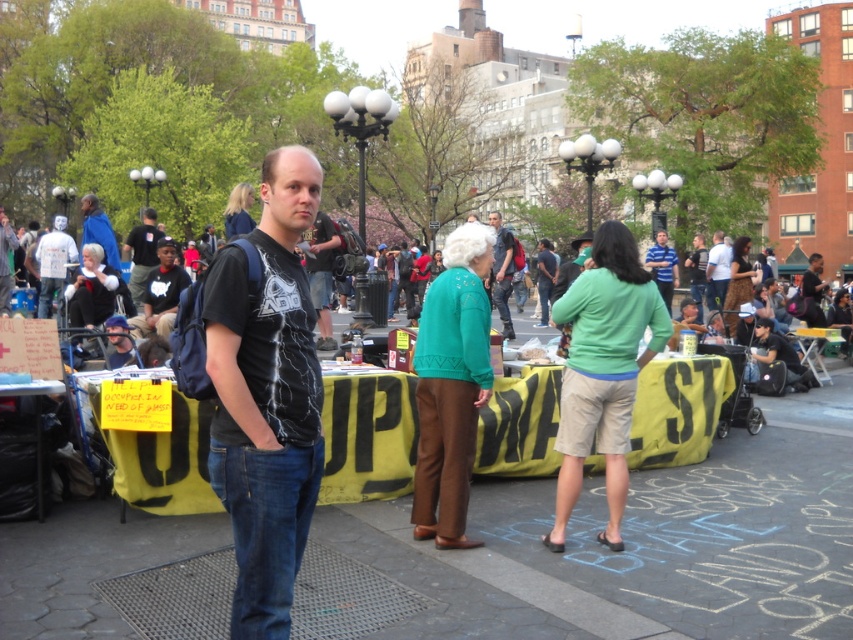
Question: Which of these objects is positioned closest to the matte black backpack at center?

Choices:
 (A) black matte t-shirt at center
 (B) dark blue backpack at center
 (C) white cotton shirt at upper right

Answer: (C)

Question: Does black matte t-shirt at center appear over dark blue backpack at center?

Choices:
 (A) yes
 (B) no

Answer: (B)

Question: Is dark blue backpack at center in front of matte black backpack at center?

Choices:
 (A) no
 (B) yes

Answer: (B)

Question: Which point appears closest to the camera in this image?

Choices:
 (A) (276, 522)
 (B) (155, 236)
 (C) (717, 237)
 (D) (498, 273)

Answer: (A)

Question: Considering the real-world distances, which object is closest to the matte black backpack at center?

Choices:
 (A) white cotton shirt at upper right
 (B) black matte t-shirt at center

Answer: (A)

Question: Does dark blue backpack at center lie in front of white cotton shirt at upper right?

Choices:
 (A) yes
 (B) no

Answer: (A)